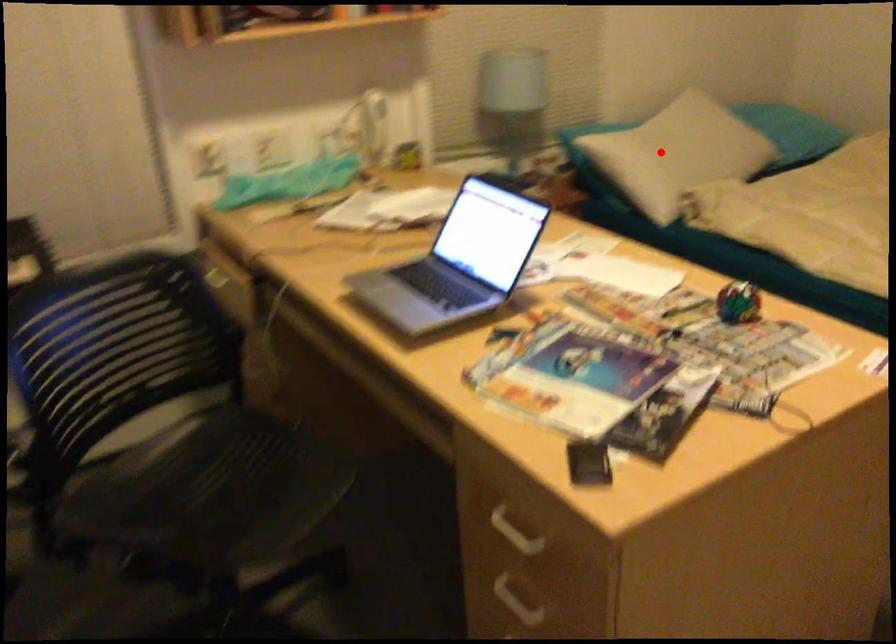
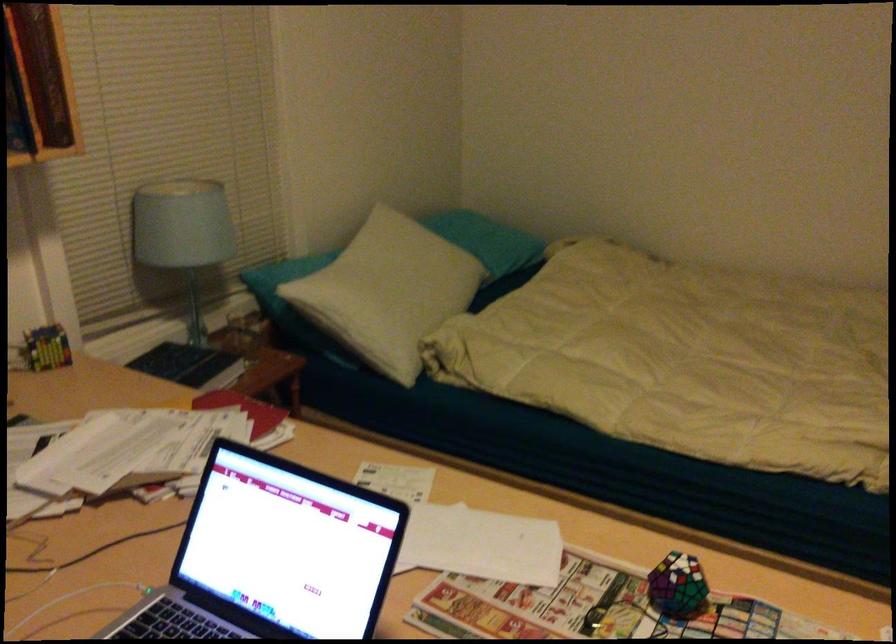
Question: I am providing you with two images of the same scene from different viewpoints. Image1 has a red point marked. In image2, the corresponding 3D location appears at what relative position? Reply with the corresponding letter.

Choices:
 (A) Closer
 (B) Farther

Answer: (A)